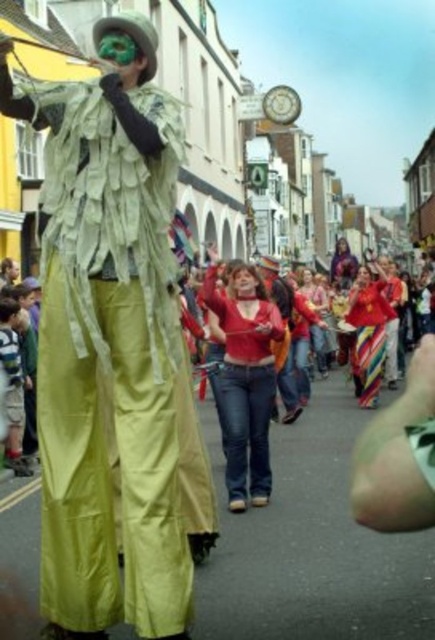
You are a photographer at the parade and want to capture both the matte red sweater at center and the smooth skin face at center in the same frame. Which object should you focus on first to ensure both are in the shot?

The matte red sweater at center is located below the smooth skin face at center, so you should focus on the smooth skin face at center first to ensure both are in the shot.

You are a photographer trying to capture a clear photo of the smooth skin face at center and the multicolored striped pants at center. Which object should you focus on first to ensure it appears sharp in the photo?

You should focus on the multicolored striped pants at center first because it is larger in size than the smooth skin face at center, making it easier to capture clearly.

You are a photographer at the parade. You want to take a photo of the matte red sweater at center and the multicolored striped pants at center. Which one is closer to the camera?

The matte red sweater at center is in front of the multicolored striped pants at center, so it is closer to the camera.